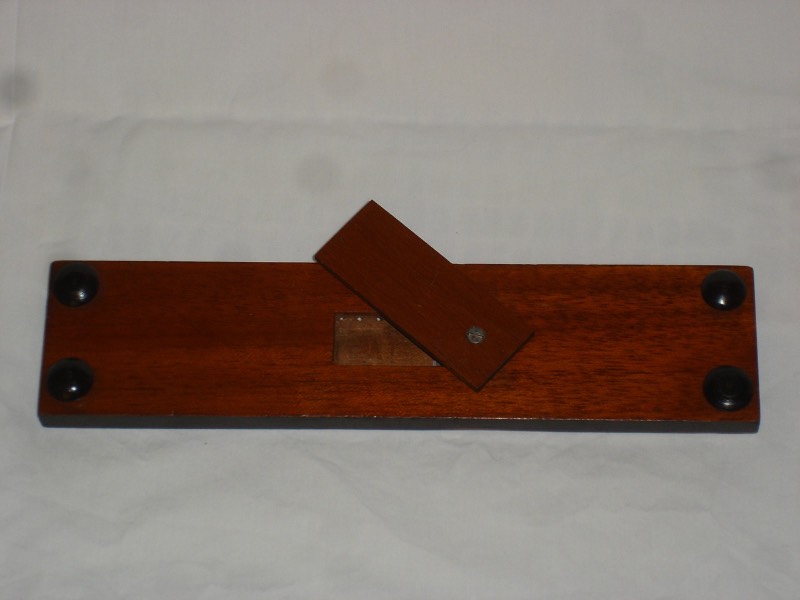
This screenshot has width=800, height=600. I want to click on white countertop, so click(x=446, y=92).